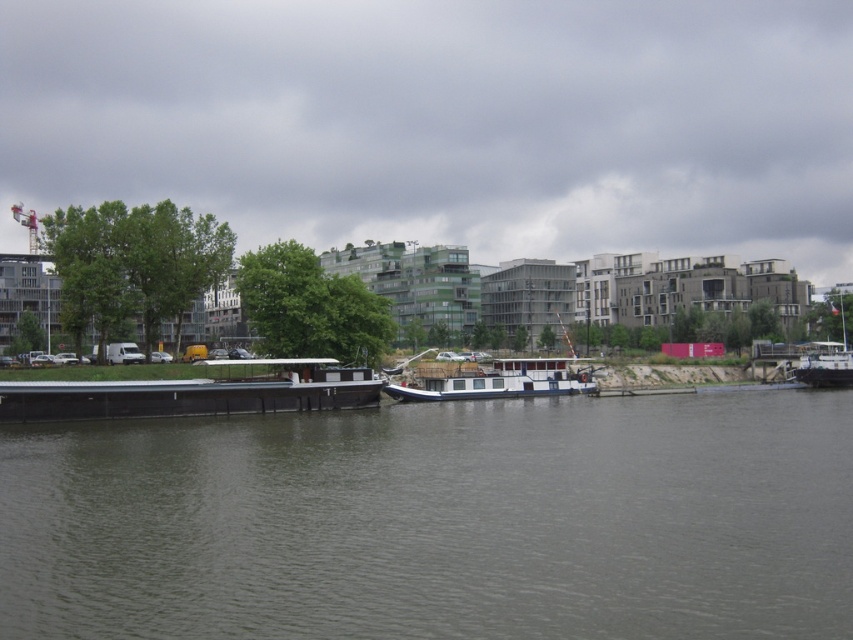
You are a photographer planning to take a photo of the black matte barge at lower left and the white matte barge at center. To ensure both are in the frame, which barge should you position closer to the camera?

The black matte barge at lower left is located above the white matte barge at center, so positioning the camera closer to the black matte barge at lower left would ensure both are in the frame.

You are standing on the riverside and want to take a photo of the white matte barge at center. There is a black matte barge at lower left blocking your view. Can you move to the right to get a clear shot?

The black matte barge at lower left is to the left of the white matte barge at center, so moving to the right should give you a clearer view without the obstruction.

You are planning to transport a large sculpture that requires a vessel with a minimum length of 15 meters. Based on the image, which of the two boats, the black matte barge at lower left or the white wooden boat at right, is more suitable for your sculpture?

The white wooden boat at right is more suitable because it is larger in size compared to the black matte barge at lower left, which has a smaller size.